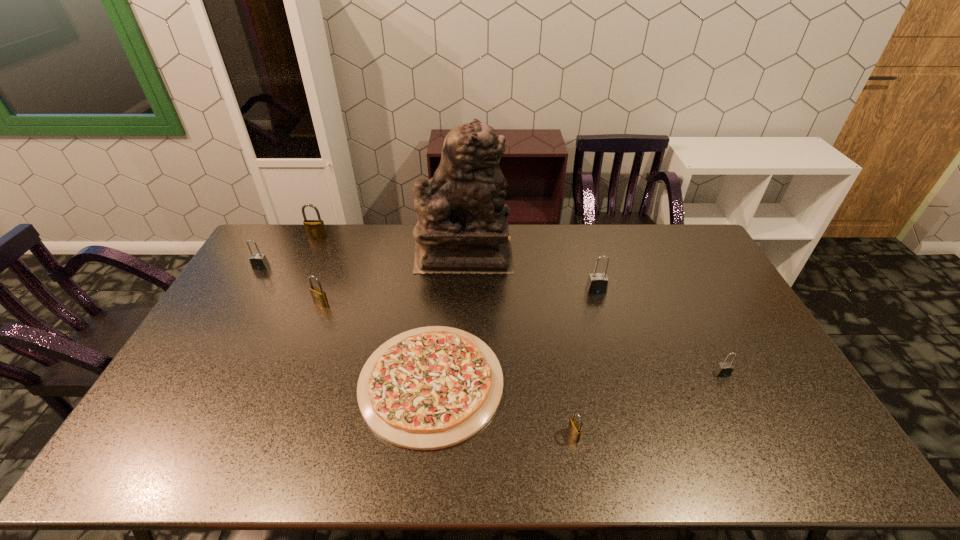
You are a GUI agent. You are given a task and a screenshot of the screen. Output one action in this format:
    pyautogui.click(x=<x>, y=<y>)
    Task: Click on the unoccupied position between the sculpture and the pizza
    The image size is (960, 540).
    Given the screenshot: What is the action you would take?
    pyautogui.click(x=447, y=318)

I want to click on free spot between the second padlock from left to right and the second farthest brass padlock, so click(320, 270).

At what (x,y) coordinates should I click in order to perform the action: click on free space between the nearest gray padlock and the second smallest gray padlock. Please return your answer as a coordinate pair (x, y). This screenshot has width=960, height=540. Looking at the image, I should click on (492, 320).

Where is `the seventh closest object relative to the shortest object`? the seventh closest object relative to the shortest object is located at coordinates (724, 369).

Where is `the sixth closest object to the tallest object`? The height and width of the screenshot is (540, 960). the sixth closest object to the tallest object is located at coordinates (574, 428).

Identify which padlock is the third closest to the second padlock from left to right. Please provide its 2D coordinates. Your answer should be formatted as a tuple, i.e. [(x, y)], where the tuple contains the x and y coordinates of a point satisfying the conditions above.

[(597, 283)]

I want to click on padlock that is the third closest to the second padlock from right to left, so click(319, 297).

The width and height of the screenshot is (960, 540). Identify the location of brass padlock object that ranks as the third closest to the second gray padlock from right to left. (315, 229).

This screenshot has height=540, width=960. I want to click on brass padlock object that ranks as the closest to the nearest padlock, so click(x=319, y=297).

This screenshot has width=960, height=540. Identify the location of the closest gray padlock to the fifth farthest padlock. (597, 283).